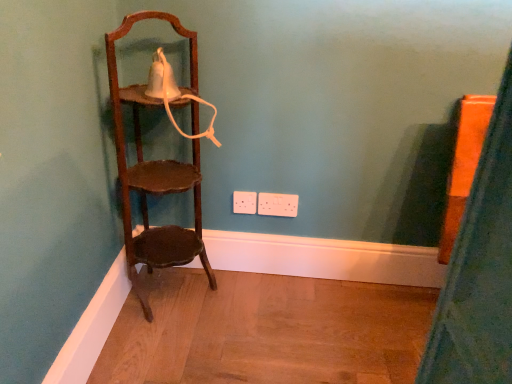
Find the location of a particular element. This screenshot has width=512, height=384. free space in front of wooden shelf at left is located at coordinates (172, 344).